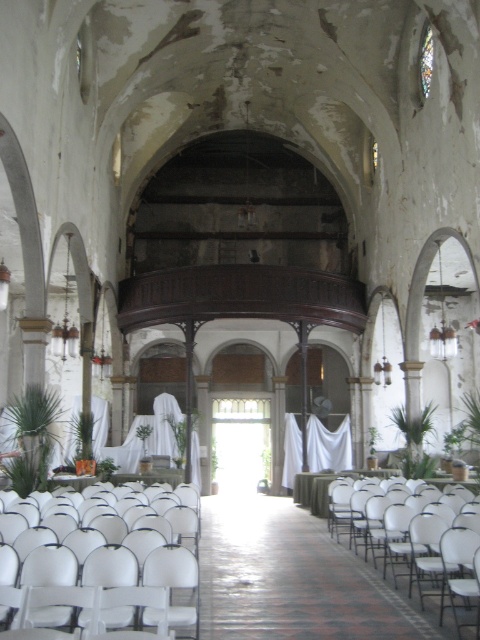
Question: Is white plastic chairs at lower center above white plastic chair at center?

Choices:
 (A) yes
 (B) no

Answer: (A)

Question: Which point is closer to the camera taking this photo?

Choices:
 (A) (33, 548)
 (B) (407, 545)

Answer: (A)

Question: Which object is farther from the camera taking this photo?

Choices:
 (A) white plastic chair at center
 (B) white plastic chairs at lower center

Answer: (A)

Question: Is the position of white plastic chairs at lower center less distant than that of white plastic chair at center?

Choices:
 (A) no
 (B) yes

Answer: (B)

Question: Can you confirm if white plastic chairs at lower center is bigger than white plastic chair at center?

Choices:
 (A) yes
 (B) no

Answer: (B)

Question: Among these objects, which one is nearest to the camera?

Choices:
 (A) white plastic chair at center
 (B) white plastic chairs at lower center

Answer: (B)